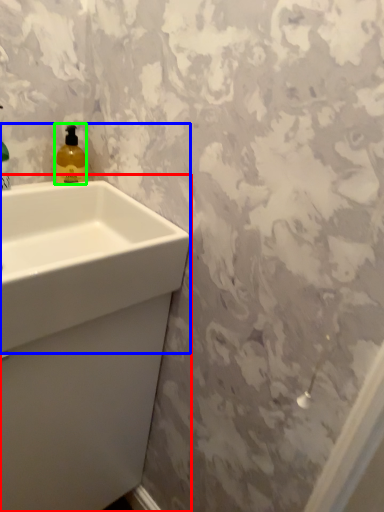
Question: Which object is the closest to the sink (highlighted by a red box)? Choose among these: sink (highlighted by a blue box) or soap dispenser (highlighted by a green box).

Choices:
 (A) sink
 (B) soap dispenser

Answer: (A)